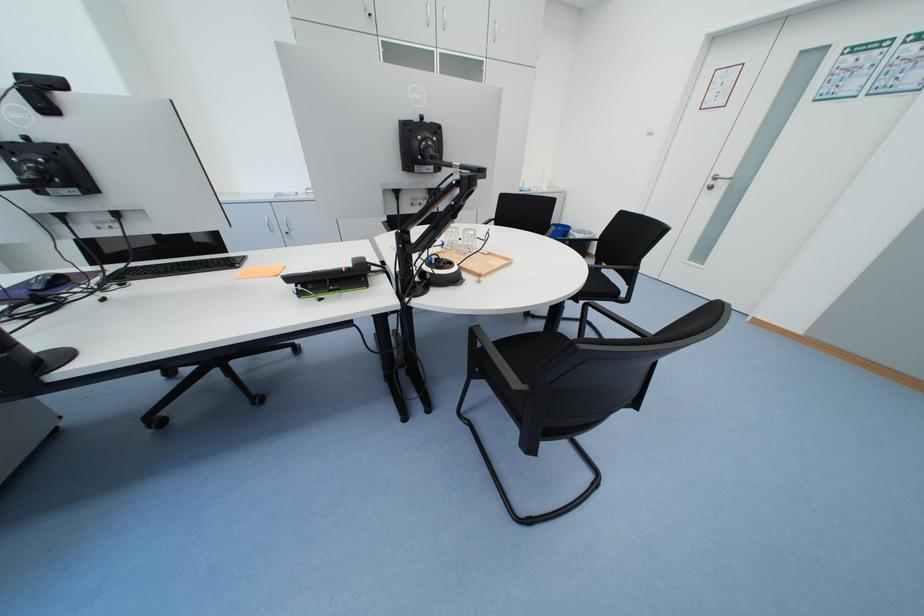
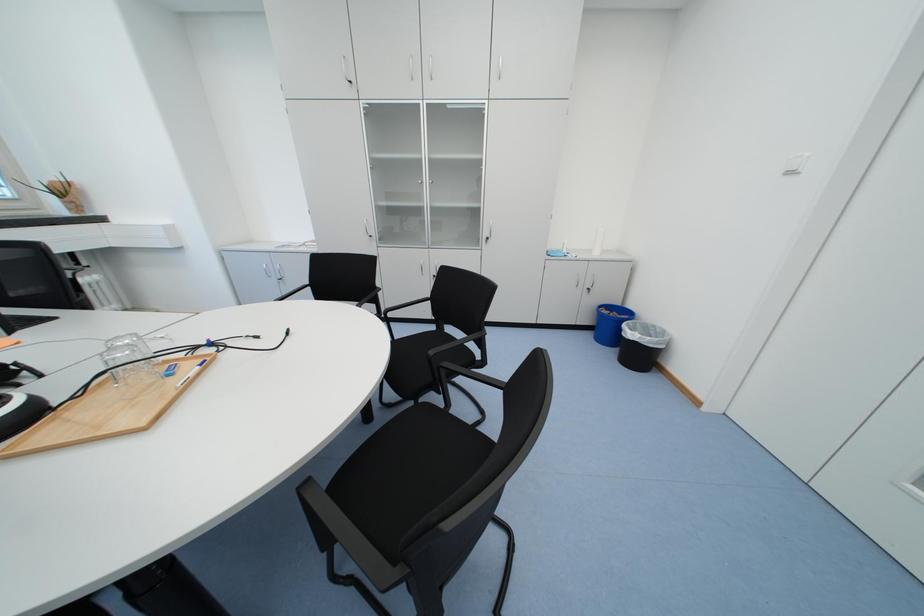
Looking at this image, the images are taken continuously from a first-person perspective. In which direction are you moving?

The cameraman walked toward right, forward.